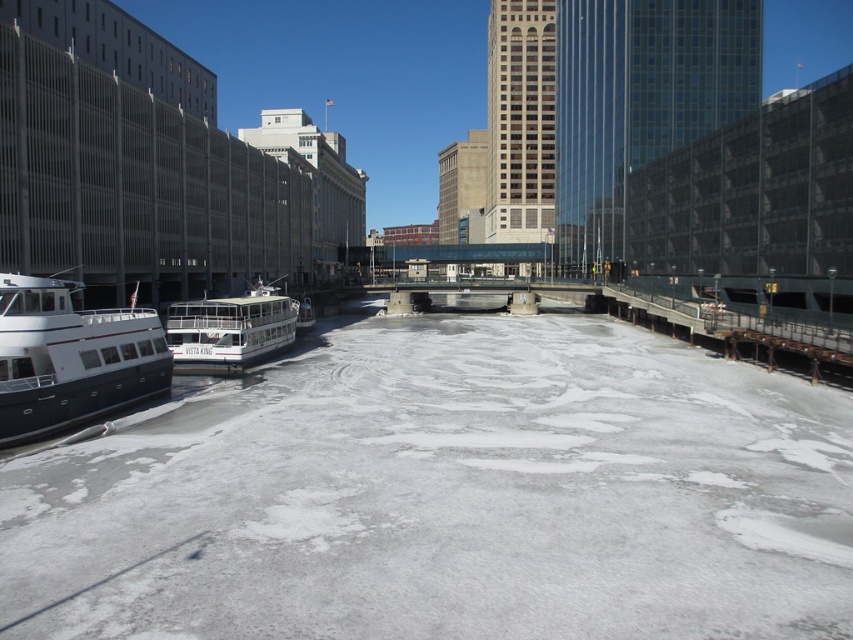
You are a tour guide planning a winter walkway along the frozen waterfront. You need to place a safety sign between the matte white boat at left and the white matte boat at center. According to the scene description, which boat should the sign be closer to?

The matte white boat at left is below the white matte boat at center, so the safety sign should be placed closer to the matte white boat at left to ensure visibility from the lower position.

You are standing at the frozen waterfront and want to walk towards the two points marked in the scene. Which point, point (49, 291) or point (248, 305), will you reach first?

Point (49, 291) is closer to the viewer than point (248, 305), so you will reach point (49, 291) first.